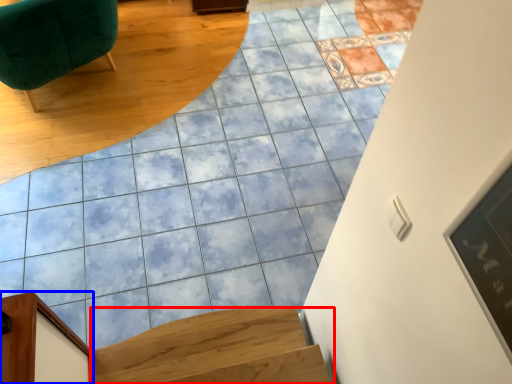
Question: Which of the following is the farthest to the observer, stairs (highlighted by a red box) or furniture (highlighted by a blue box)?

Choices:
 (A) stairs
 (B) furniture

Answer: (A)